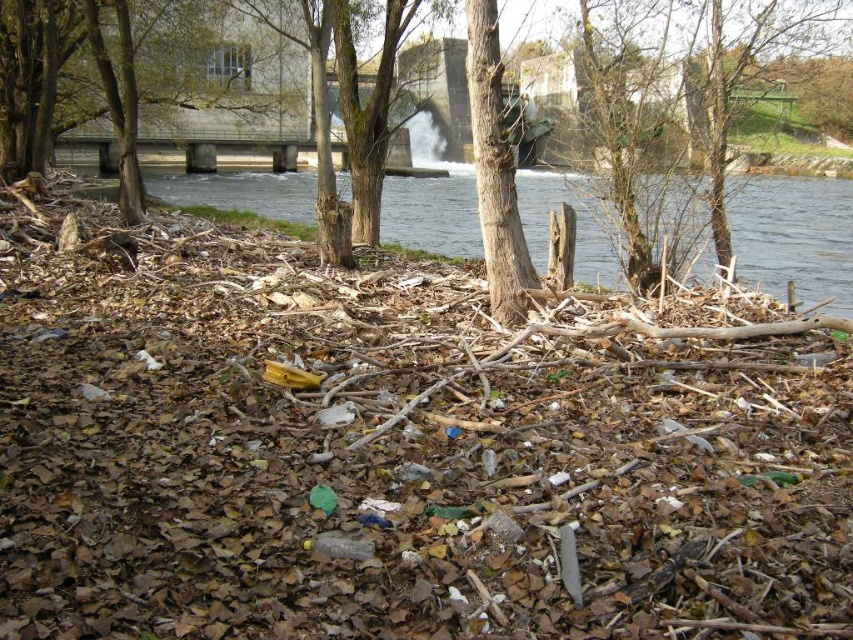
You are standing at point (474, 49) and want to walk to point (809, 211). Which direction should you move to get closer to your destination?

You should move forward because point (809, 211) is further to the camera than point (474, 49), so moving forward from your current position will bring you closer to it.

You are a kayaker approaching the riverbank shown in the image. You see the clear water at center and the brown rough bark tree at center. Which object is closer to your right side as you face the riverbank?

The brown rough bark tree at center is to the right of clear water at center, so as you face the riverbank, the brown rough bark tree at center would be closer to your right side.

From the picture: You are a bird flying over the riverbank scene. You see the brown wood tree at center and the brown rough bark tree at center. Which tree is positioned higher in the image?

A: The brown wood tree at center is located above the brown rough bark tree at center, so it is positioned higher in the image.